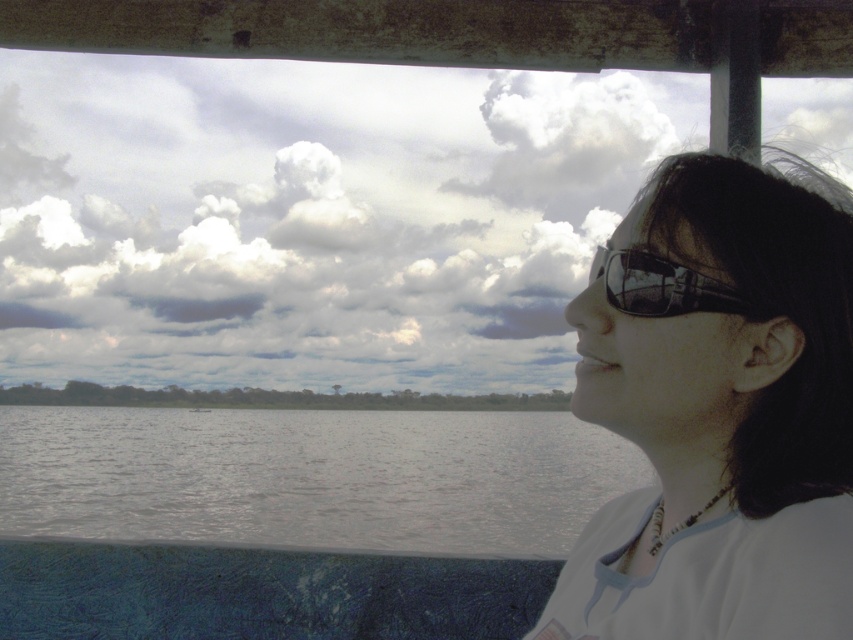
Is point (790, 531) farther from camera compared to point (83, 481)?

No, (790, 531) is closer to viewer.

Does point (587, 632) come closer to viewer compared to point (431, 518)?

Yes, point (587, 632) is closer to viewer.

Is point (590, 360) positioned before point (229, 440)?

Yes.

This screenshot has width=853, height=640. Identify the location of matte white shirt at right. (718, 410).

Between point (729, 557) and point (688, 300), which one is positioned behind?

Positioned behind is point (688, 300).

Does matte white shirt at right appear under transparent plastic glasses at upper right?

Correct, matte white shirt at right is located below transparent plastic glasses at upper right.

Locate an element on the screen. matte white shirt at right is located at coordinates (718, 410).

From the picture: Does gray matte water at center have a smaller size compared to transparent plastic glasses at upper right?

Actually, gray matte water at center might be larger than transparent plastic glasses at upper right.

Is gray matte water at center taller than transparent plastic glasses at upper right?

Yes.

Between point (363, 524) and point (653, 301), which one is positioned behind?

The point (363, 524) is more distant.

Image resolution: width=853 pixels, height=640 pixels. Identify the location of gray matte water at center. (310, 476).